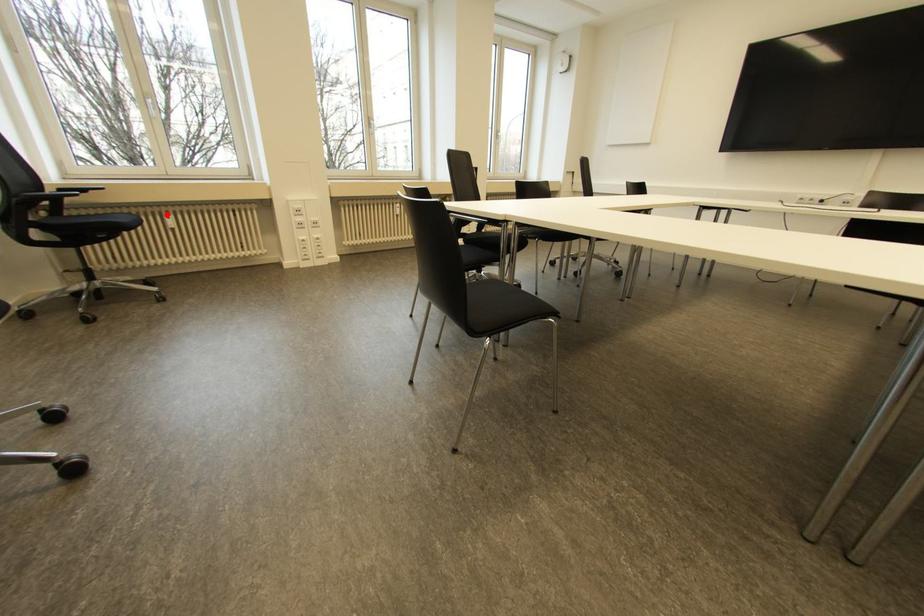
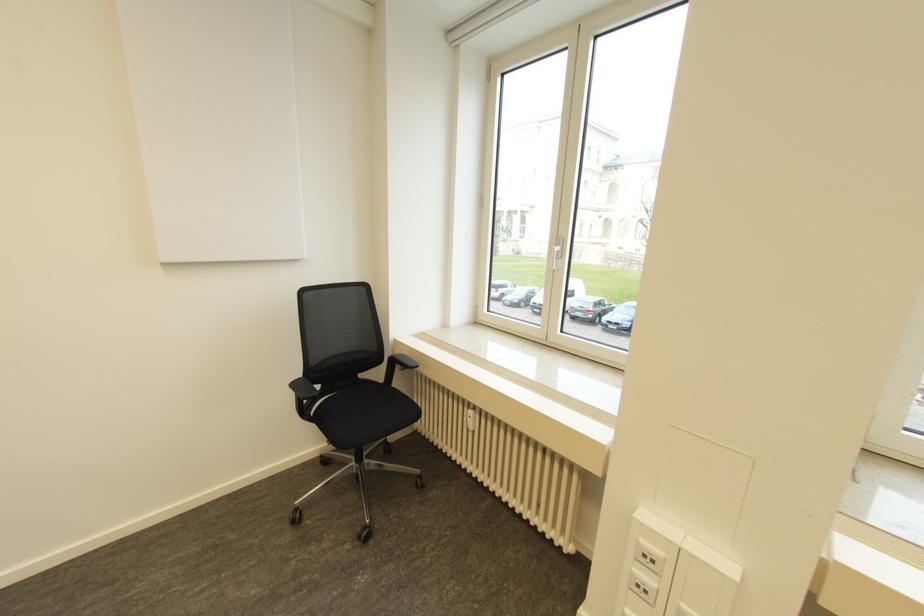
Locate, in the second image, the point that corresponds to the highlighted location in the first image.

(469, 411)